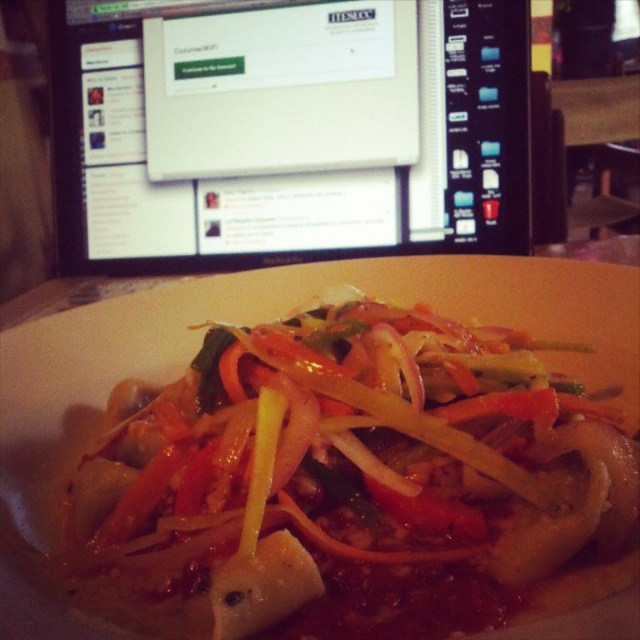
Question: Which object appears closest to the camera in this image?

Choices:
 (A) black glossy monitor at upper center
 (B) slightly translucent pasta at center

Answer: (B)

Question: Which point is farther from the camera taking this photo?

Choices:
 (A) (371, 100)
 (B) (582, 442)

Answer: (A)

Question: Which of the following is the closest to the observer?

Choices:
 (A) slightly translucent pasta at center
 (B) black glossy monitor at upper center

Answer: (A)

Question: Is slightly translucent pasta at center to the left of black glossy monitor at upper center from the viewer's perspective?

Choices:
 (A) yes
 (B) no

Answer: (B)

Question: Does slightly translucent pasta at center appear over black glossy monitor at upper center?

Choices:
 (A) yes
 (B) no

Answer: (B)

Question: Does slightly translucent pasta at center come behind black glossy monitor at upper center?

Choices:
 (A) yes
 (B) no

Answer: (B)